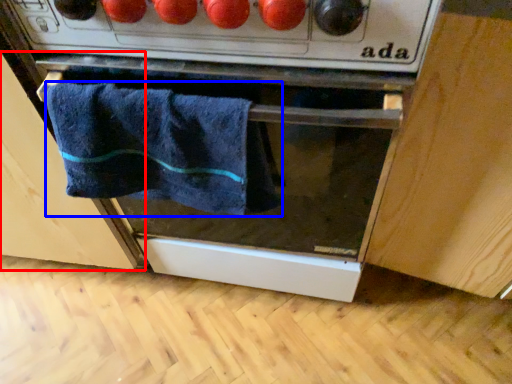
Question: Which object appears closest to the camera in this image, cabinetry (highlighted by a red box) or towel (highlighted by a blue box)?

Choices:
 (A) cabinetry
 (B) towel

Answer: (B)